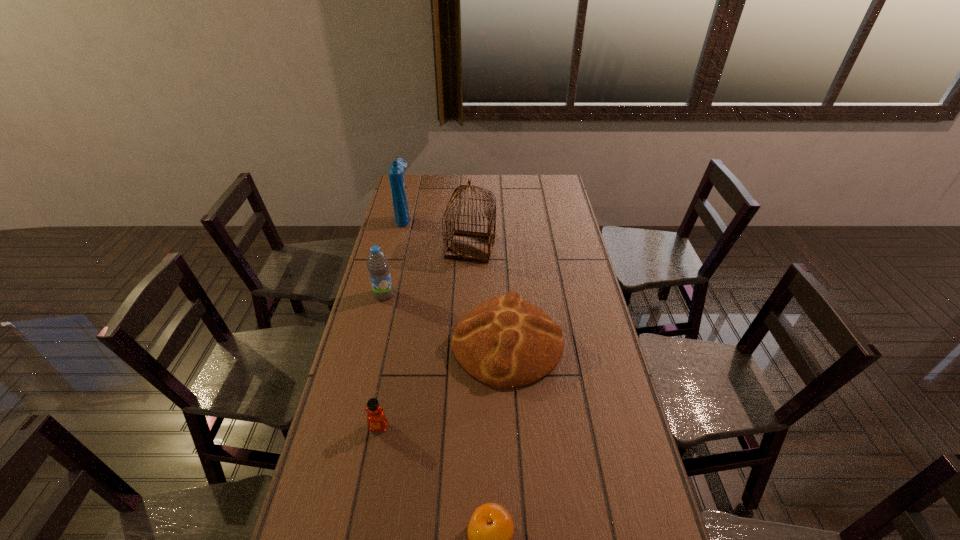
Locate an element on the screen. Image resolution: width=960 pixels, height=540 pixels. free region located on the front of the water bottle is located at coordinates (378, 318).

This screenshot has width=960, height=540. Find the location of `vacant space located on the back of the third nearest object`. vacant space located on the back of the third nearest object is located at coordinates point(502,259).

Identify the location of vacant space situated on the front label of the honey. (365, 501).

Locate an element on the screen. shampoo that is at the left edge is located at coordinates (396, 171).

Find the location of a particular element. water bottle situated at the left edge is located at coordinates click(377, 263).

Image resolution: width=960 pixels, height=540 pixels. Find the location of `honey at the left edge`. honey at the left edge is located at coordinates (376, 419).

Image resolution: width=960 pixels, height=540 pixels. Find the location of `object present at the right edge`. object present at the right edge is located at coordinates (504, 342).

What are the coordinates of `free space at the far edge of the desktop` in the screenshot? It's located at (441, 190).

In the image, there is a desktop. Identify the location of vacant area at the left edge. (371, 326).

Find the location of a particular element. blank space at the right edge is located at coordinates (567, 329).